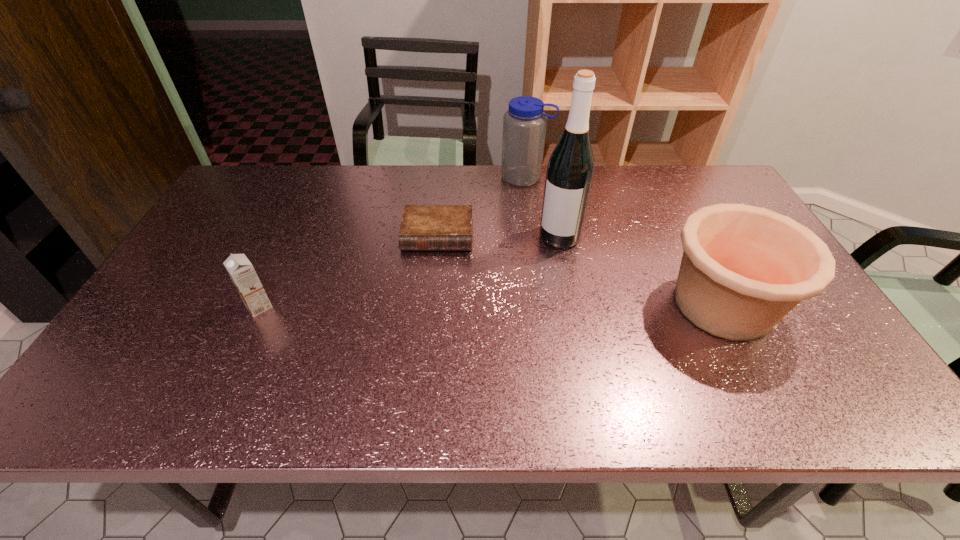
In order to click on object present at the far edge in this screenshot , I will do coord(524,125).

You are a GUI agent. You are given a task and a screenshot of the screen. Output one action in this format:
    pyautogui.click(x=<x>, y=<y>)
    Task: Click on the object that is at the near edge
    The height and width of the screenshot is (540, 960).
    Given the screenshot: What is the action you would take?
    pyautogui.click(x=744, y=268)

The width and height of the screenshot is (960, 540). Find the location of `object situated at the right edge`. object situated at the right edge is located at coordinates (744, 268).

You are a GUI agent. You are given a task and a screenshot of the screen. Output one action in this format:
    pyautogui.click(x=<x>, y=<y>)
    Task: Click on the object at the near right corner
    This screenshot has width=960, height=540.
    Given the screenshot: What is the action you would take?
    pyautogui.click(x=744, y=268)

Find the location of a particular element. free space at the far edge is located at coordinates (365, 191).

Where is `free space at the near edge of the desktop`? This screenshot has width=960, height=540. free space at the near edge of the desktop is located at coordinates (291, 340).

This screenshot has height=540, width=960. What are the coordinates of `free space at the right edge of the desktop` in the screenshot? It's located at (798, 307).

In the image, there is a desktop. Where is `vacant space at the far left corner`? This screenshot has height=540, width=960. vacant space at the far left corner is located at coordinates (252, 195).

Find the location of a particular element. This screenshot has height=540, width=960. vacant space at the near right corner of the desktop is located at coordinates (780, 339).

The width and height of the screenshot is (960, 540). Find the location of `empty space that is in between the rightmost object and the second object from left to right`. empty space that is in between the rightmost object and the second object from left to right is located at coordinates (580, 270).